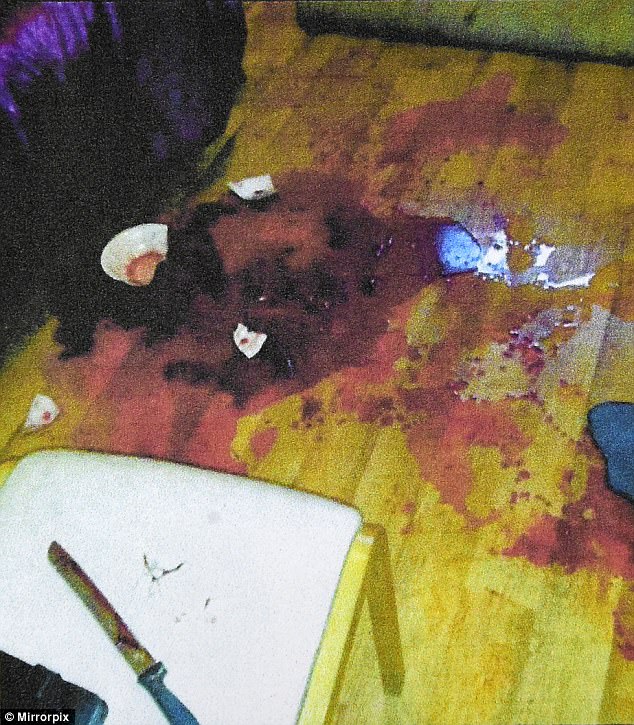
Where is `chair`? This screenshot has width=634, height=725. chair is located at coordinates (283, 581).